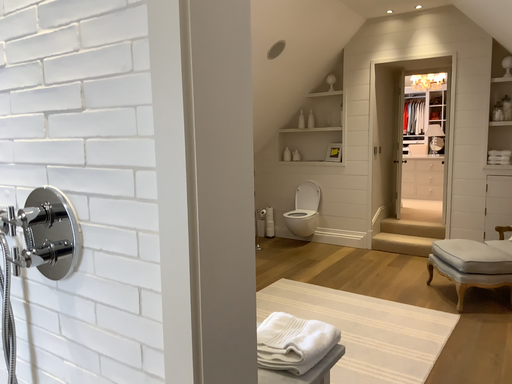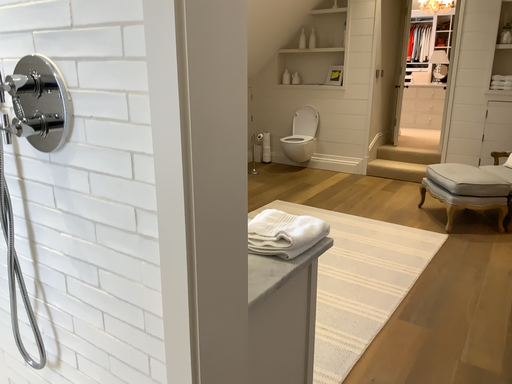
Question: How did the camera likely rotate when shooting the video?

Choices:
 (A) rotated upward
 (B) rotated downward

Answer: (B)